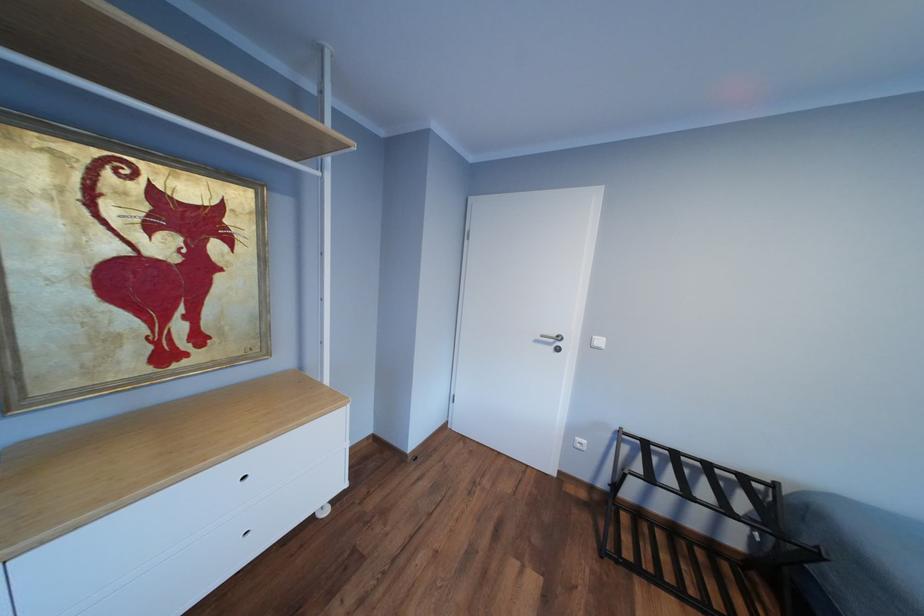
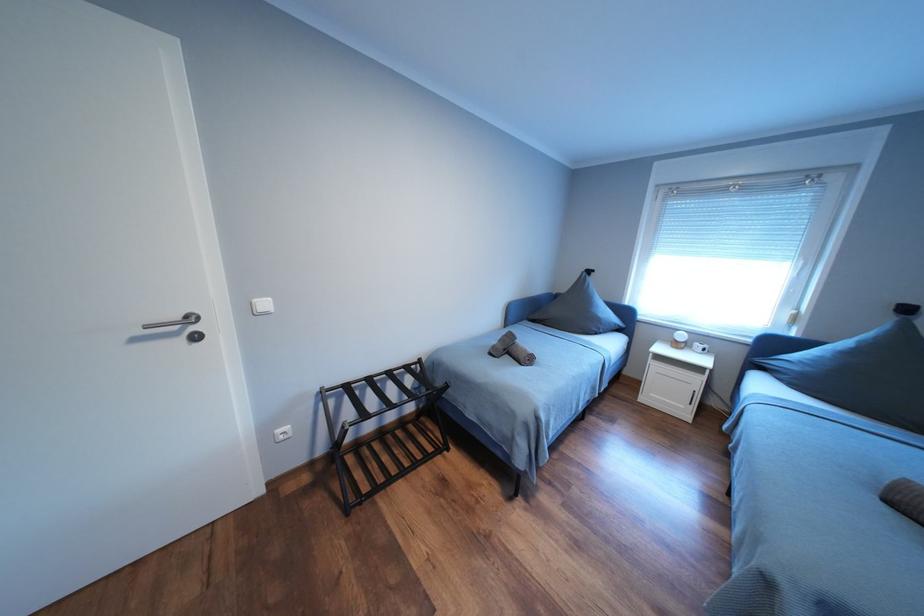
From the picture: The images are taken continuously from a first-person perspective. In which direction is your viewpoint rotating?

The rotation direction of the camera is right-down.